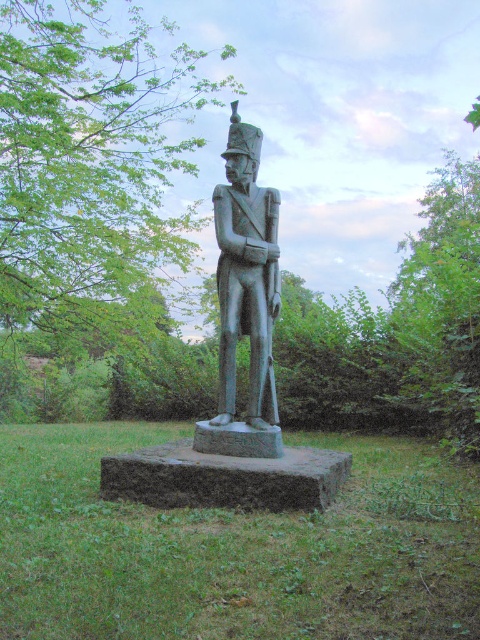
Is green leafy tree at upper center to the left of bronze statue at center from the viewer's perspective?

Indeed, green leafy tree at upper center is positioned on the left side of bronze statue at center.

Is green leafy tree at upper center positioned in front of bronze statue at center?

That is False.

Is point (55, 182) more distant than point (227, 358)?

Yes, point (55, 182) is farther from viewer.

Identify the location of green leafy tree at upper center. This screenshot has height=640, width=480. (87, 163).